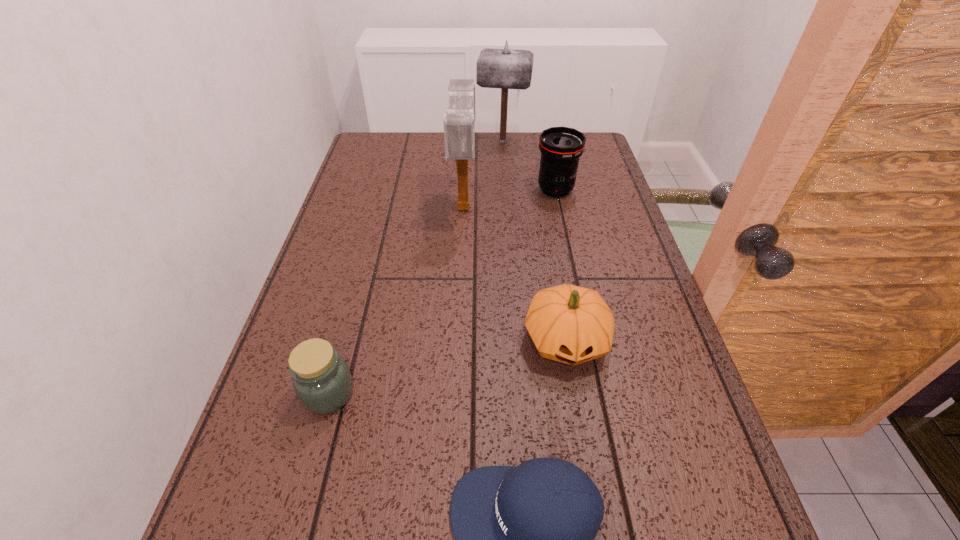
Image resolution: width=960 pixels, height=540 pixels. Identify the location of vacant region that satisfies the following two spatial constraints: 1. on the back side of the nearer mallet; 2. on the left side of the leftmost object. (379, 207).

The width and height of the screenshot is (960, 540). I want to click on blank space that satisfies the following two spatial constraints: 1. on the back side of the second shortest object; 2. on the left side of the left mallet, so click(379, 207).